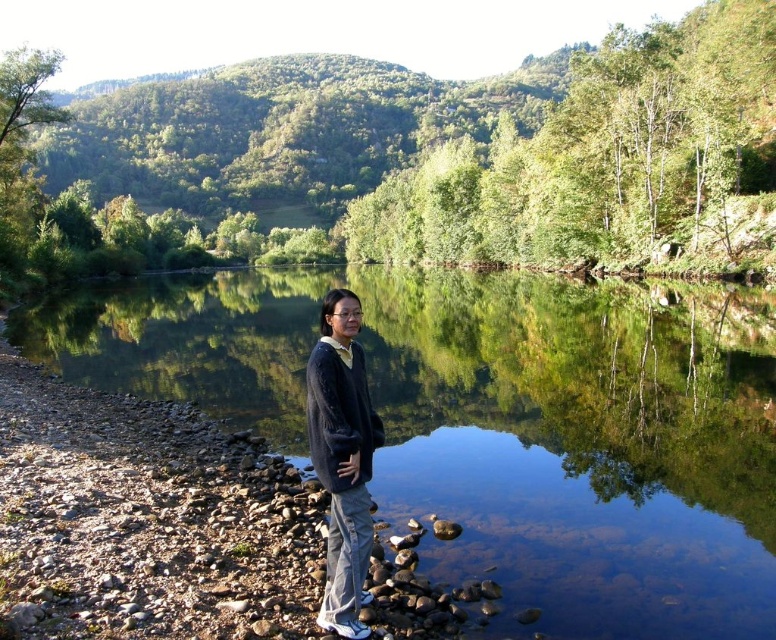
Does clear glass water at center have a lesser width compared to dark blue sweater at center?

In fact, clear glass water at center might be wider than dark blue sweater at center.

Which is behind, point (745, 412) or point (357, 444)?

The point (745, 412) is behind.

This screenshot has height=640, width=776. I want to click on clear glass water at center, so click(x=497, y=422).